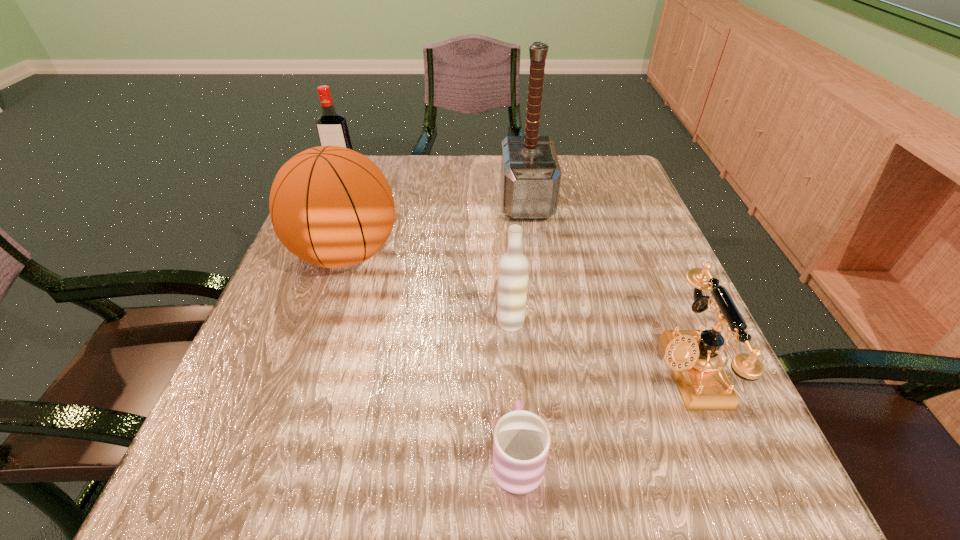
This screenshot has height=540, width=960. I want to click on vacant region between the shortest object and the telephone, so click(603, 413).

At what (x,y) coordinates should I click in order to perform the action: click on vacant area that lies between the left vodka and the cup. Please return your answer as a coordinate pair (x, y). Image resolution: width=960 pixels, height=540 pixels. Looking at the image, I should click on (430, 317).

This screenshot has width=960, height=540. In order to click on vacant space in between the shortest object and the nearer vodka in this screenshot , I will do `click(514, 389)`.

At what (x,y) coordinates should I click in order to perform the action: click on vacant area that lies between the farther vodka and the shortest object. Please return your answer as a coordinate pair (x, y). This screenshot has height=540, width=960. Looking at the image, I should click on (430, 317).

Find the location of a particular element. The width and height of the screenshot is (960, 540). free space between the left vodka and the shortest object is located at coordinates pos(430,317).

Find the location of a particular element. free space that is in between the cup and the second shortest object is located at coordinates (603, 413).

Image resolution: width=960 pixels, height=540 pixels. I want to click on free space between the fifth tallest object and the shortest object, so click(x=603, y=413).

Point out which object is positioned as the second nearest to the farther vodka. Please provide its 2D coordinates. Your answer should be formatted as a tuple, i.e. [(x, y)], where the tuple contains the x and y coordinates of a point satisfying the conditions above.

[(530, 177)]

Select which object is the second closest to the farther vodka. Please provide its 2D coordinates. Your answer should be formatted as a tuple, i.e. [(x, y)], where the tuple contains the x and y coordinates of a point satisfying the conditions above.

[(530, 177)]

Locate an element on the screen. The image size is (960, 540). blank area in the image that satisfies the following two spatial constraints: 1. on the front and back of the nearer vodka; 2. on the left side of the farther vodka is located at coordinates (280, 322).